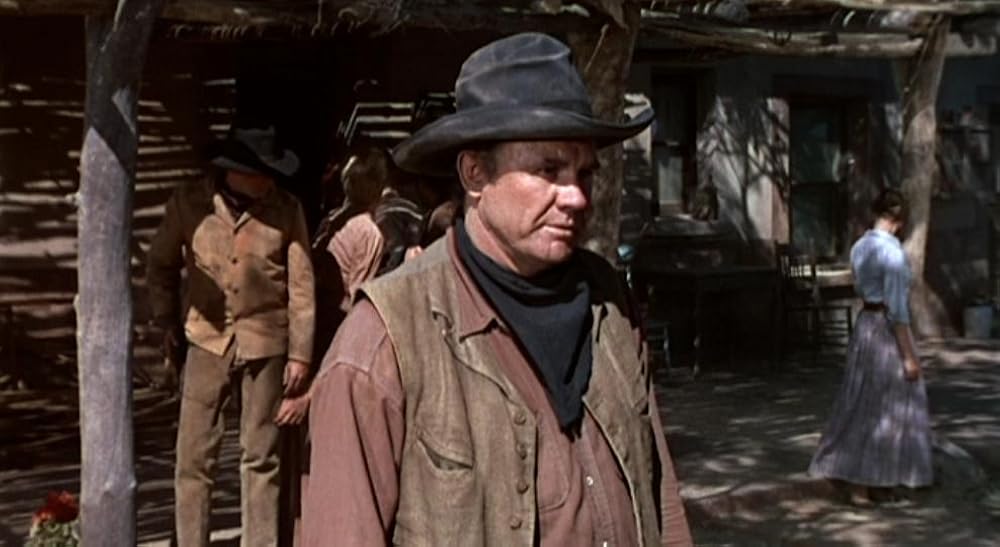
You are a GUI agent. You are given a task and a screenshot of the screen. Output one action in this format:
    pyautogui.click(x=<x>, y=<y>)
    Task: Click on the shadow on wall
    The width and height of the screenshot is (1000, 547).
    Given the screenshot: What is the action you would take?
    pyautogui.click(x=753, y=126)